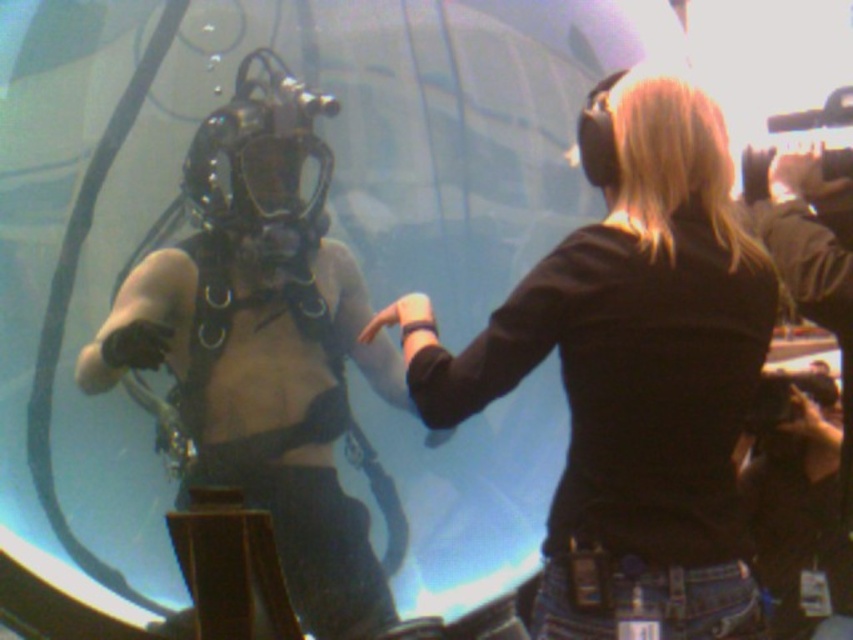
You are a photographer standing at the center of the aquarium. You need to take a photo of the black matte shirt at upper right without including the diver in the glass enclosure. Is the point marked at coordinate (631,372) the correct position to frame the shot?

The point marked at coordinate (631,372) corresponds to the black matte shirt at upper right, so yes, positioning the camera at that point would allow you to frame the shot without including the diver in the glass enclosure.

You are standing in an aquarium and see the black matte shirt at upper right. If you want to throw a small ball to reach the shirt, will it travel more than 20 feet?

The black matte shirt at upper right and viewer are 24.44 feet apart from each other, so the ball will travel more than 20 feet to reach the shirt.